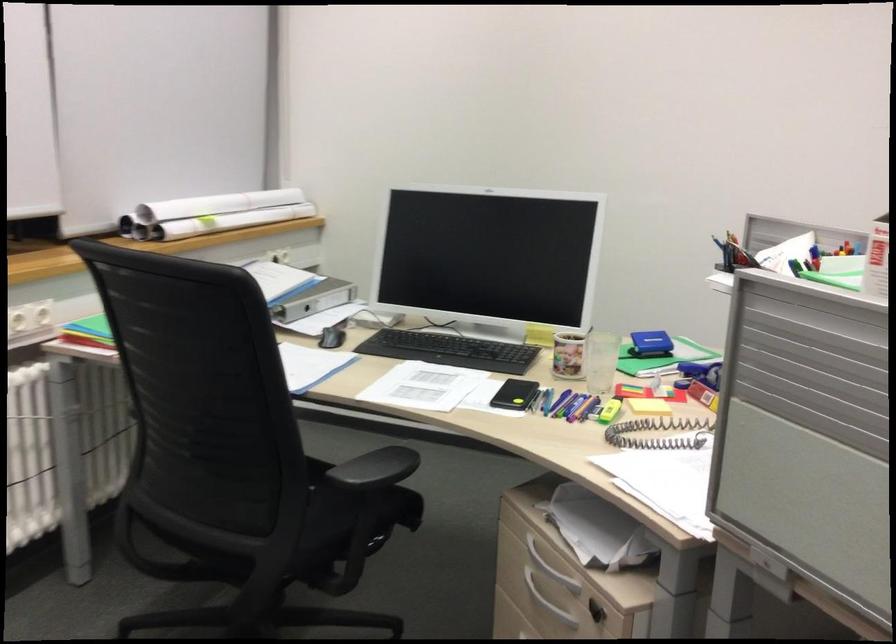
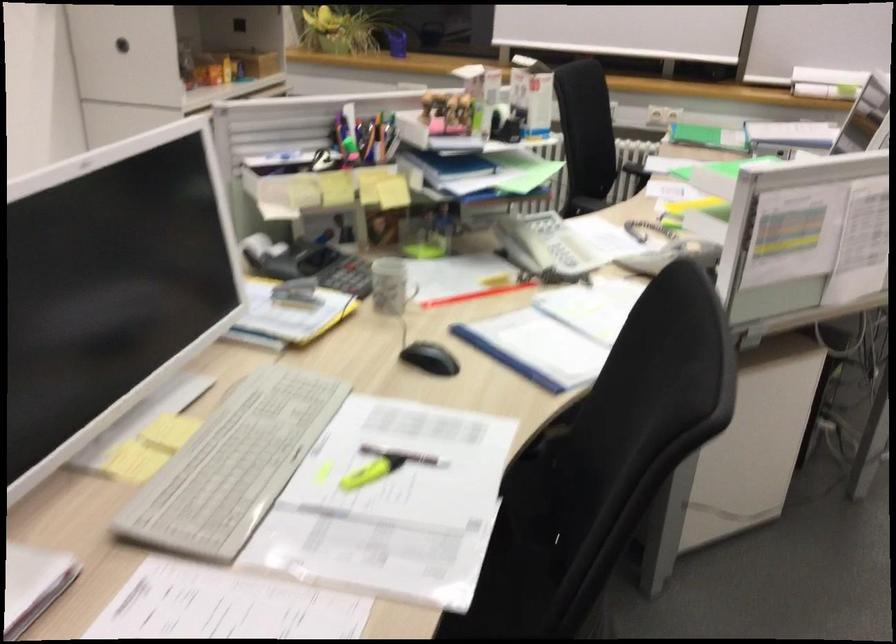
Question: I am providing you with two images of the same scene from different viewpoints. Please identify which objects are invisible in image2.

Choices:
 (A) cloth bag handle
 (B) round cabinet handle
 (C) patterned mug
 (D) silver drawer handle

Answer: (D)